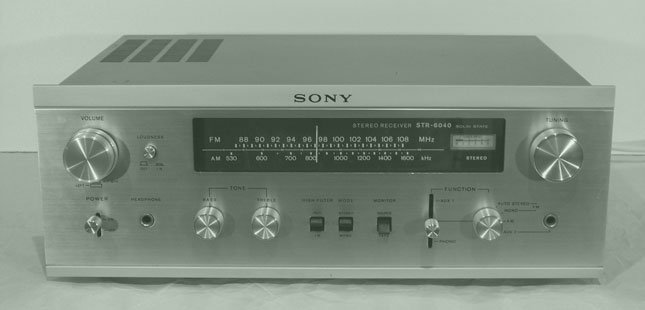
Find the location of a particular element. The image size is (645, 310). switches is located at coordinates (320, 228), (353, 228), (386, 230).